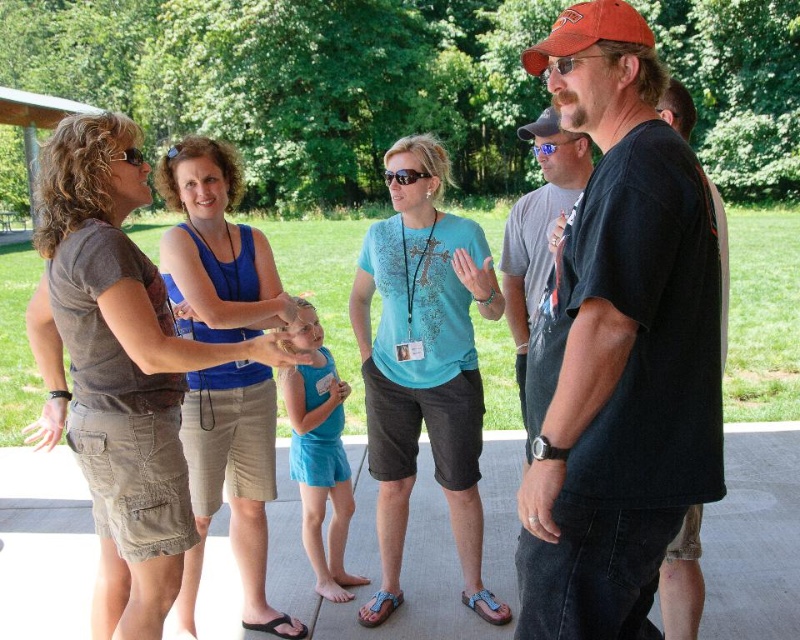
Is point (634, 100) positioned in front of point (504, 266)?

Yes, point (634, 100) is in front of point (504, 266).

Is black cotton t-shirt at center wider than gray cotton t-shirt at center?

Indeed, black cotton t-shirt at center has a greater width compared to gray cotton t-shirt at center.

Who is more forward, (628, 4) or (582, 140)?

Point (628, 4)

The width and height of the screenshot is (800, 640). Identify the location of black cotton t-shirt at center. (618, 348).

Which is more to the right, gray cotton t-shirt at center or blue reflective lens glasses at center?

blue reflective lens glasses at center

In the scene shown: How distant is gray cotton t-shirt at center from blue reflective lens glasses at center?

gray cotton t-shirt at center and blue reflective lens glasses at center are 7.67 meters apart.

This screenshot has width=800, height=640. I want to click on gray cotton t-shirt at center, so click(537, 230).

Is point (634, 224) positioned in front of point (533, 148)?

Yes.

Find the location of a particular element. Image resolution: width=800 pixels, height=640 pixels. black cotton t-shirt at center is located at coordinates (618, 348).

Where is `black cotton t-shirt at center`? Image resolution: width=800 pixels, height=640 pixels. black cotton t-shirt at center is located at coordinates (618, 348).